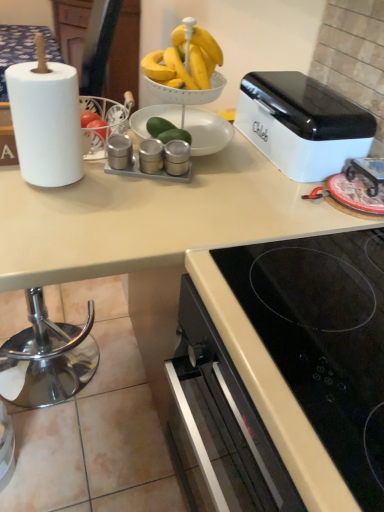
Question: Is white matte paper towel at left outside of satin silver salt and pepper shakers at center, which ranks as the second appliance in left-to-right order?

Choices:
 (A) no
 (B) yes

Answer: (B)

Question: Considering the relative sizes of white matte paper towel at left and satin silver salt and pepper shakers at center, which ranks as the second appliance in left-to-right order, in the image provided, is white matte paper towel at left taller than satin silver salt and pepper shakers at center, which ranks as the second appliance in left-to-right order,?

Choices:
 (A) no
 (B) yes

Answer: (B)

Question: Does white matte paper towel at left appear on the left side of satin silver salt and pepper shakers at center, which ranks as the second appliance in left-to-right order?

Choices:
 (A) no
 (B) yes

Answer: (B)

Question: Considering the relative positions of white matte paper towel at left and satin silver salt and pepper shakers at center, the 2th appliance in the right-to-left sequence, in the image provided, is white matte paper towel at left to the right of satin silver salt and pepper shakers at center, the 2th appliance in the right-to-left sequence, from the viewer's perspective?

Choices:
 (A) no
 (B) yes

Answer: (A)

Question: Is the depth of white matte paper towel at left less than that of satin silver salt and pepper shakers at center, which ranks as the second appliance in left-to-right order?

Choices:
 (A) yes
 (B) no

Answer: (A)

Question: From a real-world perspective, is white matte paper towel at left positioned above or below satin silver salt and pepper shakers at center, marked as the third appliance in a left-to-right arrangement?

Choices:
 (A) above
 (B) below

Answer: (A)

Question: Which is correct: white matte paper towel at left is inside satin silver salt and pepper shakers at center, which appears as the first appliance when viewed from the right, or outside of it?

Choices:
 (A) outside
 (B) inside

Answer: (A)

Question: Is point (61, 124) closer or farther from the camera than point (183, 148)?

Choices:
 (A) closer
 (B) farther

Answer: (A)

Question: In the image, is white matte paper towel at left on the left side or the right side of satin silver salt and pepper shakers at center, which appears as the first appliance when viewed from the right?

Choices:
 (A) right
 (B) left

Answer: (B)

Question: Does point (180, 141) appear closer or farther from the camera than point (150, 148)?

Choices:
 (A) farther
 (B) closer

Answer: (A)

Question: In terms of width, does satin silver salt and pepper shakers at center, marked as the third appliance in a left-to-right arrangement, look wider or thinner when compared to satin silver salt and pepper shakers at center, the 2th appliance in the right-to-left sequence?

Choices:
 (A) wide
 (B) thin

Answer: (A)

Question: Based on their positions, is satin silver salt and pepper shakers at center, marked as the third appliance in a left-to-right arrangement, located to the left or right of satin silver salt and pepper shakers at center, the 2th appliance in the right-to-left sequence?

Choices:
 (A) right
 (B) left

Answer: (A)

Question: Is satin silver salt and pepper shakers at center, which appears as the first appliance when viewed from the right, bigger or smaller than satin silver salt and pepper shakers at center, which ranks as the second appliance in left-to-right order?

Choices:
 (A) big
 (B) small

Answer: (A)

Question: From the image's perspective, is white matte paper towel at left located above or below satin silver salt and pepper shakers at center, which ranks as the second appliance in left-to-right order?

Choices:
 (A) below
 (B) above

Answer: (B)

Question: From their relative heights in the image, would you say white matte paper towel at left is taller or shorter than satin silver salt and pepper shakers at center, the 2th appliance in the right-to-left sequence?

Choices:
 (A) tall
 (B) short

Answer: (A)